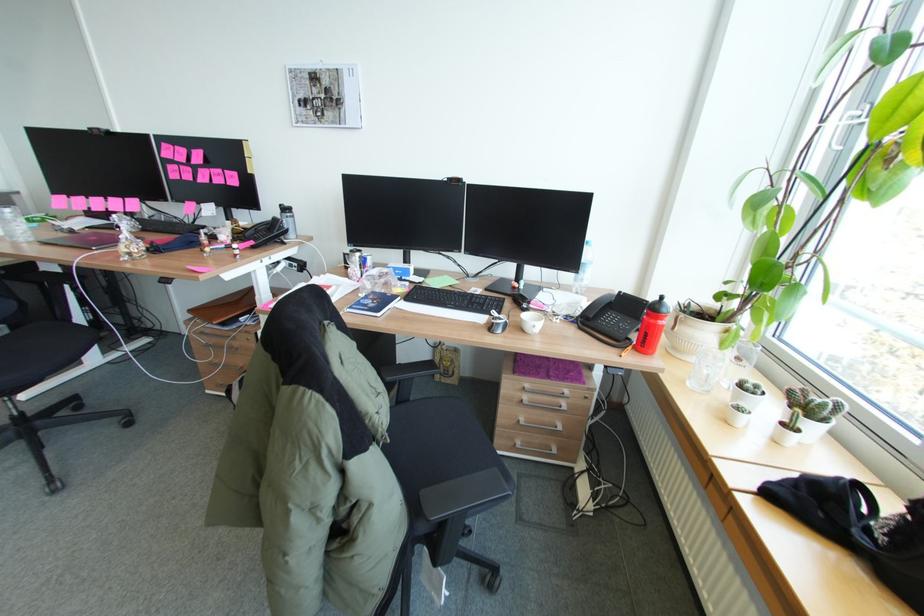
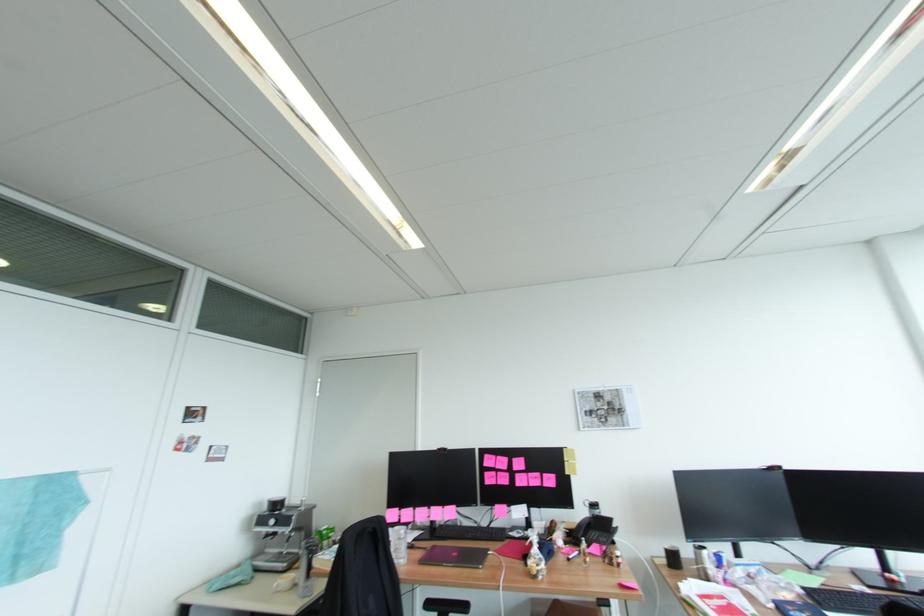
In the second image, find the point that corresponds to (134,253) in the first image.

(546, 570)